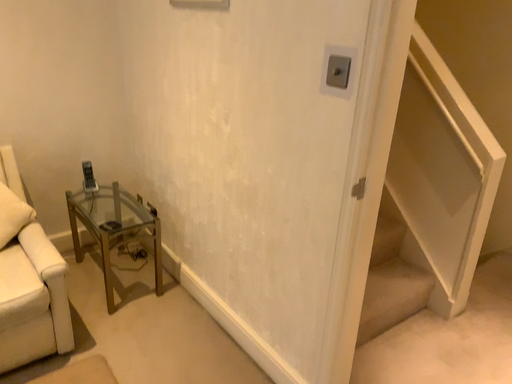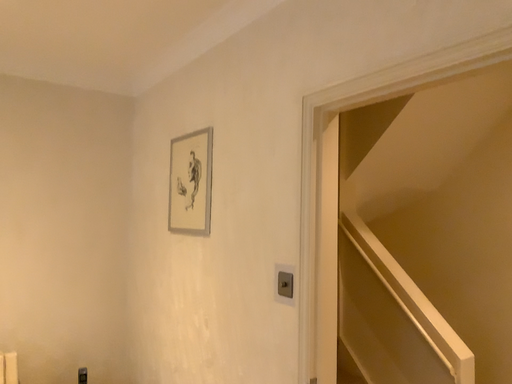
Question: Which way did the camera rotate in the video?

Choices:
 (A) rotated upward
 (B) rotated downward

Answer: (A)